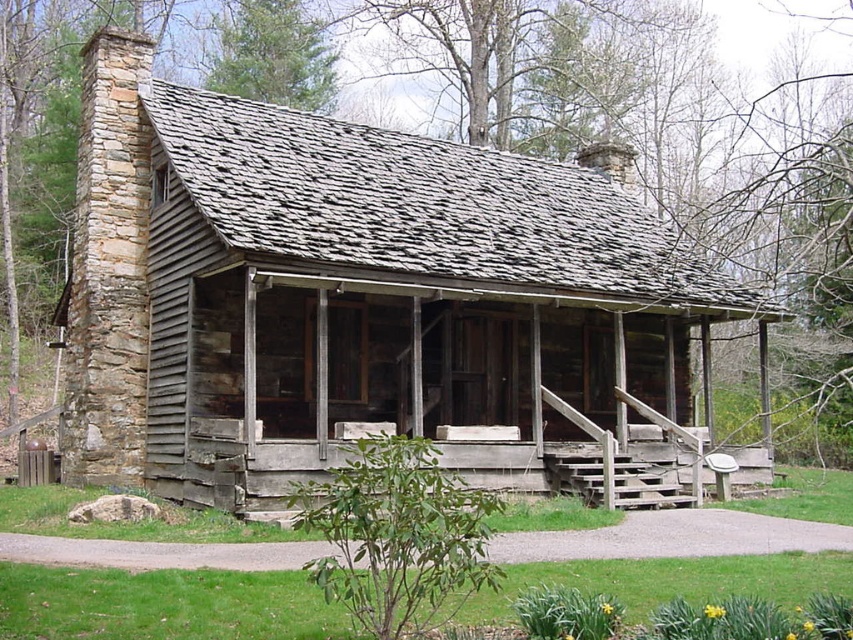
Does rustic wood cabin at center appear on the left side of weathered wood porch at center?

Correct, you'll find rustic wood cabin at center to the left of weathered wood porch at center.

Does rustic wood cabin at center appear on the right side of weathered wood porch at center?

In fact, rustic wood cabin at center is to the left of weathered wood porch at center.

Is point (172, 477) farther from camera compared to point (706, 429)?

No, it is in front of (706, 429).

Identify the location of rustic wood cabin at center. This screenshot has width=853, height=640. (349, 294).